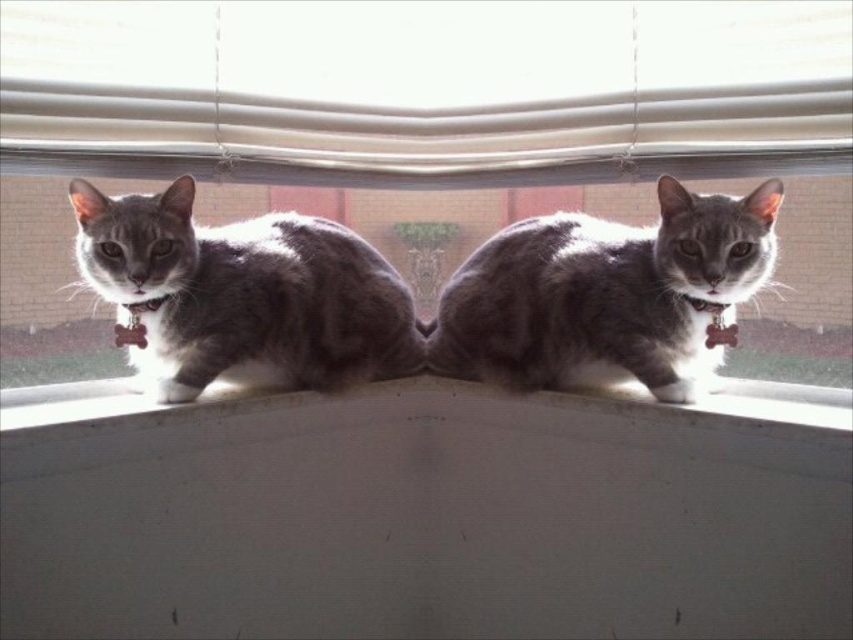
You are a small toy mouse that is 2 centimeters long. You want to move from the transparent glass window at center to the white fabric curtain at upper center. Can you fit through the space between them?

The distance between the transparent glass window at center and the white fabric curtain at upper center is 3.76 centimeters, which is wider than the toy mouse of 2 centimeters. Therefore, the mouse can fit through the space between them.

You are a photographer trying to capture the gray fur cat at center through the window. The white fabric curtain at upper center is partially blocking your view. Can you adjust your position to see the cat without the curtain obstructing your view?

The white fabric curtain at upper center is closer to the viewer than the gray fur cat at center. By moving your position to the side or adjusting your angle, you can avoid the obstruction caused by the curtain and capture the cat clearly.